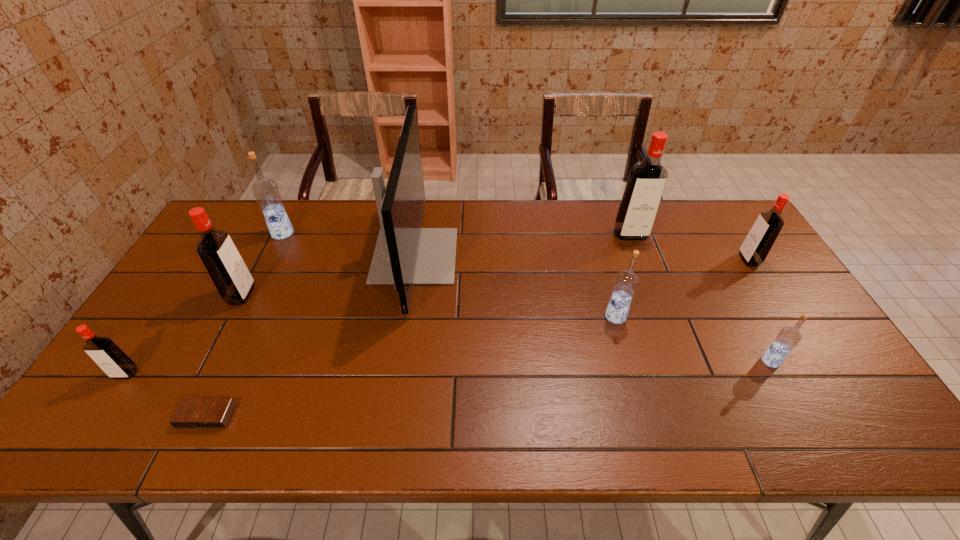
At what (x,y) coordinates should I click in order to perform the action: click on vacant region located 0.180m on the front and back of the fourth nearest vodka. Please return your answer as a coordinate pair (x, y). The width and height of the screenshot is (960, 540). Looking at the image, I should click on (314, 295).

The width and height of the screenshot is (960, 540). Find the location of `vacant space located on the front and back of the second smallest red vodka`. vacant space located on the front and back of the second smallest red vodka is located at coordinates (671, 260).

In order to click on vacant space located on the front and back of the second smallest red vodka in this screenshot , I will do `click(674, 260)`.

Image resolution: width=960 pixels, height=540 pixels. I want to click on free region located on the front and back of the second smallest red vodka, so click(722, 260).

The image size is (960, 540). I want to click on free space located on the front of the sixth object from left to right, so click(651, 442).

I want to click on vacant space situated on the front of the rightmost blue vodka, so coord(808,429).

This screenshot has width=960, height=540. Find the location of `blank space located 0.060m on the front and back of the leftmost red vodka`. blank space located 0.060m on the front and back of the leftmost red vodka is located at coordinates (107, 403).

The image size is (960, 540). I want to click on computer monitor that is positioned at the far edge, so click(405, 254).

The image size is (960, 540). I want to click on object at the near edge, so click(191, 412).

The image size is (960, 540). In order to click on object that is at the left edge in this screenshot , I will do `click(105, 353)`.